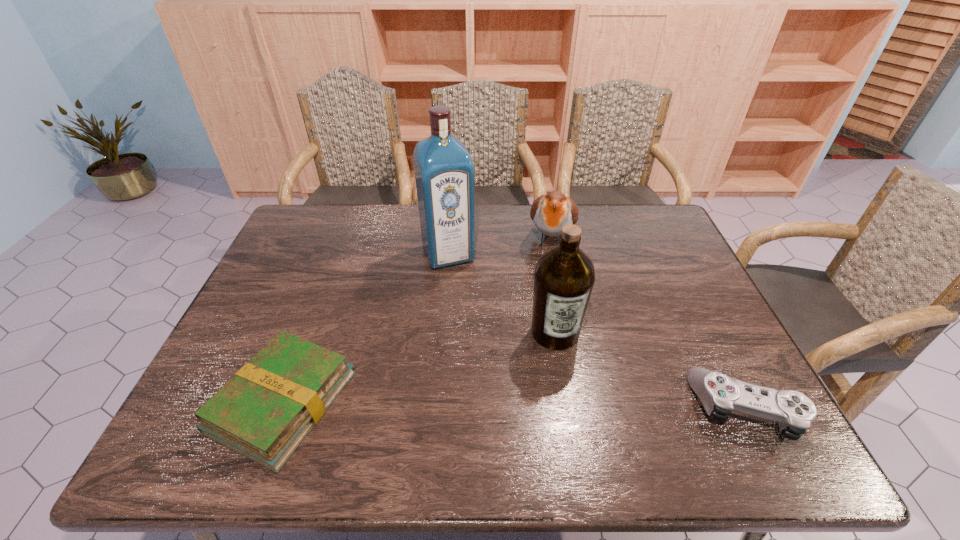
Find the location of a particular element. The image size is (960, 540). book is located at coordinates (264, 412).

What are the coordinates of `the rightmost object` in the screenshot? It's located at (720, 394).

Locate an element on the screen. bird is located at coordinates (550, 212).

Find the location of a particular element. Image resolution: width=960 pixels, height=540 pixels. the fourth object from right to left is located at coordinates (444, 172).

Locate an element on the screen. liquor is located at coordinates (444, 172).

Locate an element on the screen. the fourth shortest object is located at coordinates (564, 276).

Where is `free space located 0.160m on the back of the leftmost object`? The height and width of the screenshot is (540, 960). free space located 0.160m on the back of the leftmost object is located at coordinates (321, 301).

Where is `vacant space positioned 0.280m on the back of the control`? Image resolution: width=960 pixels, height=540 pixels. vacant space positioned 0.280m on the back of the control is located at coordinates (688, 292).

Where is `free region located 0.170m at the face of the bird`? This screenshot has width=960, height=540. free region located 0.170m at the face of the bird is located at coordinates (544, 303).

Identify the location of free space located at the face of the bird. The image size is (960, 540). (544, 301).